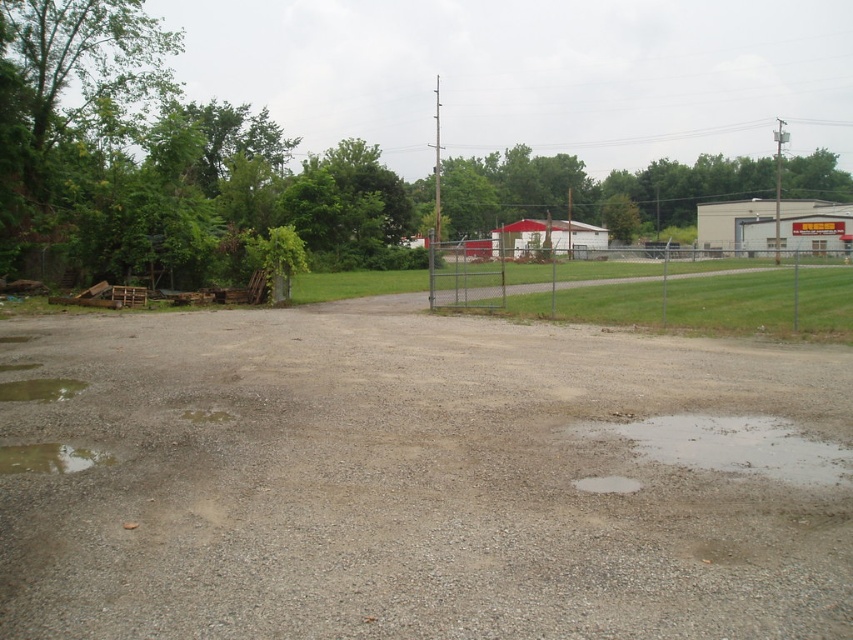
Does gray gravel dirt field at center appear over clear water at lower right?

Correct, gray gravel dirt field at center is located above clear water at lower right.

Who is higher up, gray gravel dirt field at center or clear water at lower right?

gray gravel dirt field at center

Is point (767, 390) closer to camera compared to point (729, 428)?

No, it is not.

Identify the location of gray gravel dirt field at center. (421, 480).

Is transparent wet gravel at lower left below white matte puddle at center?

No.

Can you confirm if transparent wet gravel at lower left is positioned to the left of white matte puddle at center?

Indeed, transparent wet gravel at lower left is positioned on the left side of white matte puddle at center.

What are the coordinates of `transparent wet gravel at lower left` in the screenshot? It's located at (48, 458).

Where is `transparent wet gravel at lower left`? The width and height of the screenshot is (853, 640). transparent wet gravel at lower left is located at coordinates (48, 458).

Is point (705, 426) behind point (630, 477)?

That is True.

Locate an element on the screen. Image resolution: width=853 pixels, height=640 pixels. clear water at lower right is located at coordinates (730, 445).